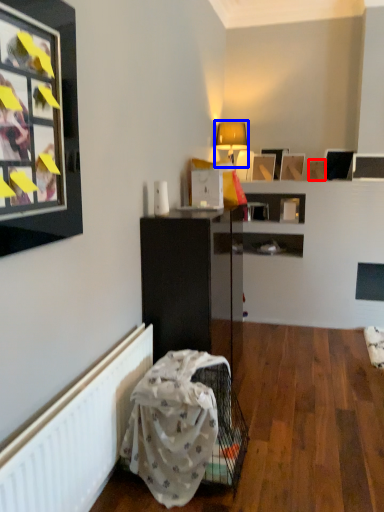
Question: Which object appears farthest to the camera in this image, picture frame (highlighted by a red box) or table lamp (highlighted by a blue box)?

Choices:
 (A) picture frame
 (B) table lamp

Answer: (A)